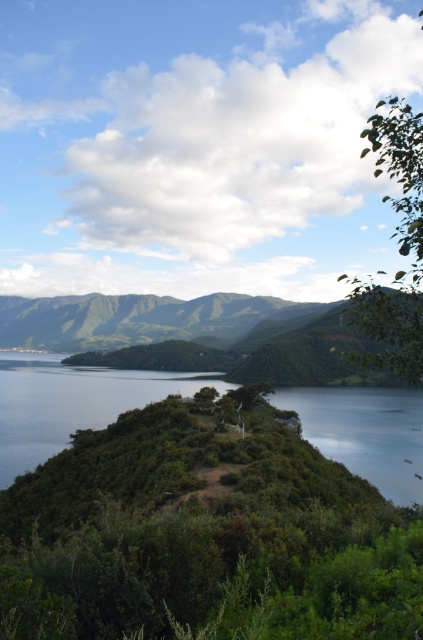
Identify the location of green leafy shrubs at center. (205, 534).

Locate an element on the screen. Image resolution: width=423 pixels, height=640 pixels. green leafy shrubs at center is located at coordinates pos(205,534).